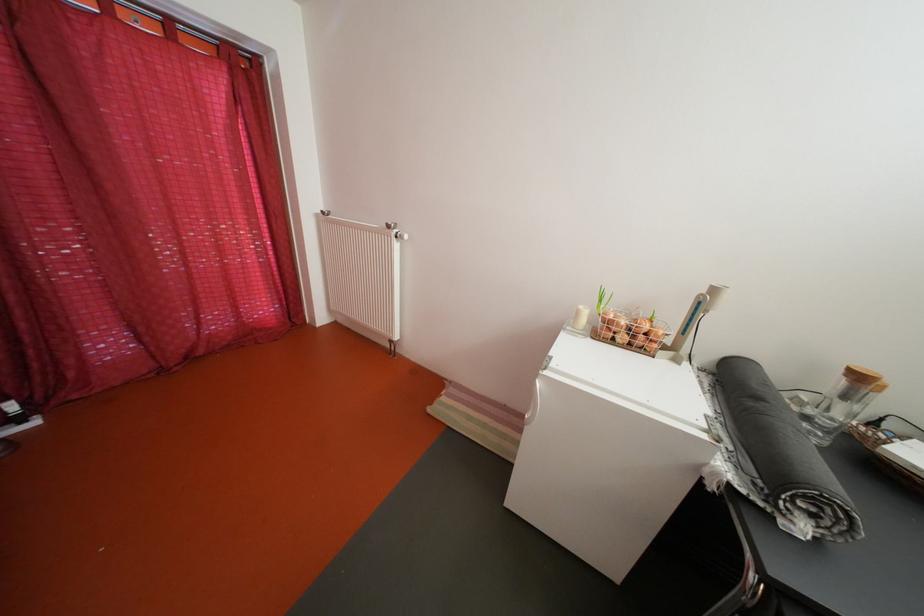
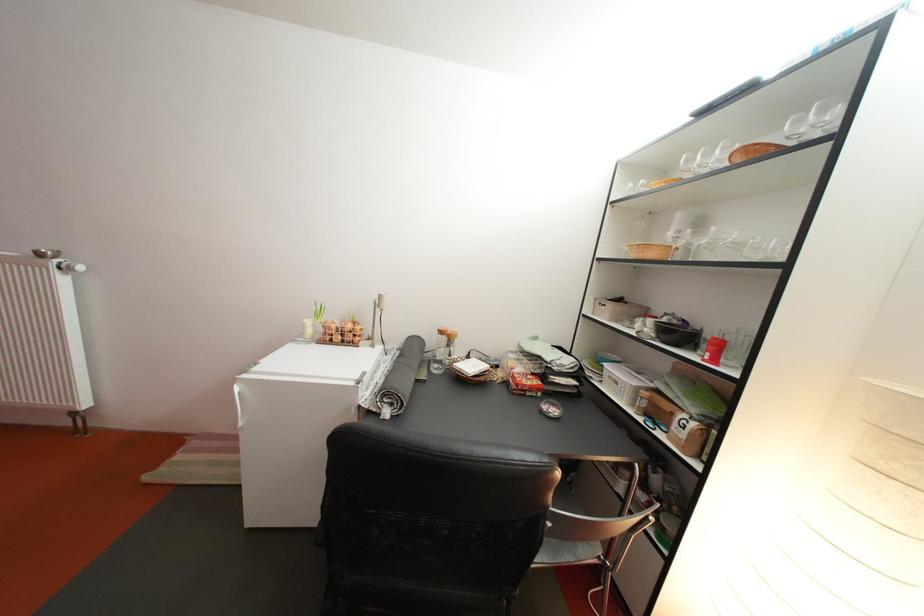
The point at (407, 237) is marked in the first image. Where is the corresponding point in the second image?

(68, 267)